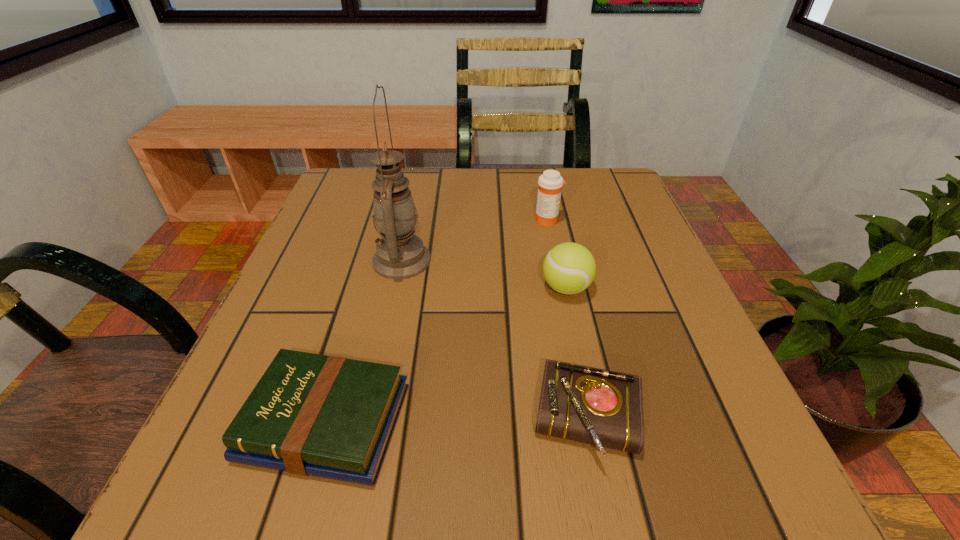
Where is `free space located 0.180m on the back of the diary`? free space located 0.180m on the back of the diary is located at coordinates (563, 294).

Locate an element on the screen. This screenshot has height=540, width=960. object that is at the far edge is located at coordinates (550, 183).

The image size is (960, 540). I want to click on book that is at the near edge, so click(326, 416).

Identify the location of diary that is at the near edge. (595, 406).

You are a GUI agent. You are given a task and a screenshot of the screen. Output one action in this format:
    pyautogui.click(x=<x>, y=<y>)
    Task: Click on the oil lamp at the left edge
    The width and height of the screenshot is (960, 540).
    Given the screenshot: What is the action you would take?
    pyautogui.click(x=400, y=254)

At what (x,y) coordinates should I click in order to perform the action: click on book at the left edge. Please return your answer as a coordinate pair (x, y). The height and width of the screenshot is (540, 960). Looking at the image, I should click on [326, 416].

Where is `tennis ball located in the right edge section of the desktop`? The width and height of the screenshot is (960, 540). tennis ball located in the right edge section of the desktop is located at coordinates (569, 268).

Where is `diary that is at the right edge`? The image size is (960, 540). diary that is at the right edge is located at coordinates (595, 406).

At what (x,y) coordinates should I click in order to perform the action: click on object that is at the near left corner. Please return your answer as a coordinate pair (x, y). Looking at the image, I should click on (326, 416).

The height and width of the screenshot is (540, 960). I want to click on object that is at the near right corner, so click(595, 406).